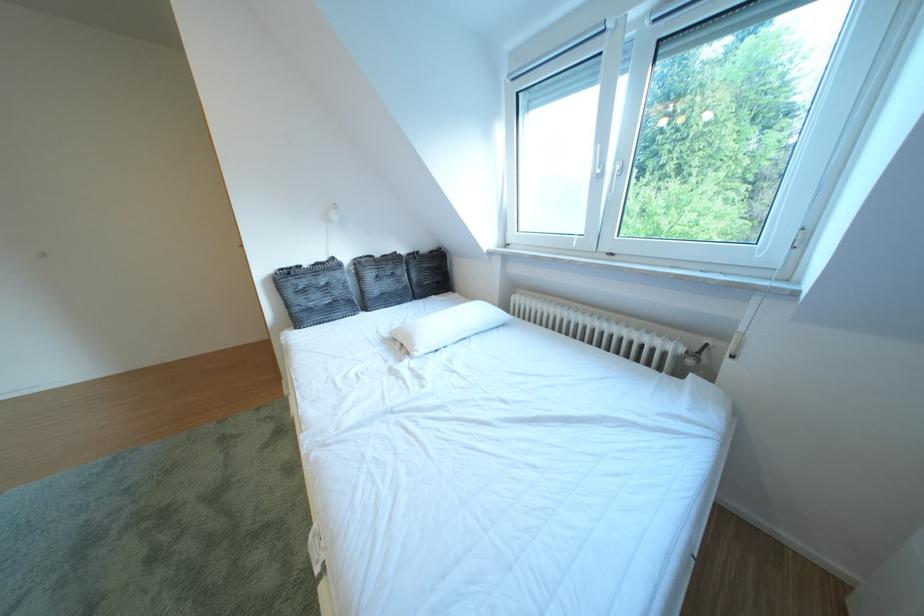
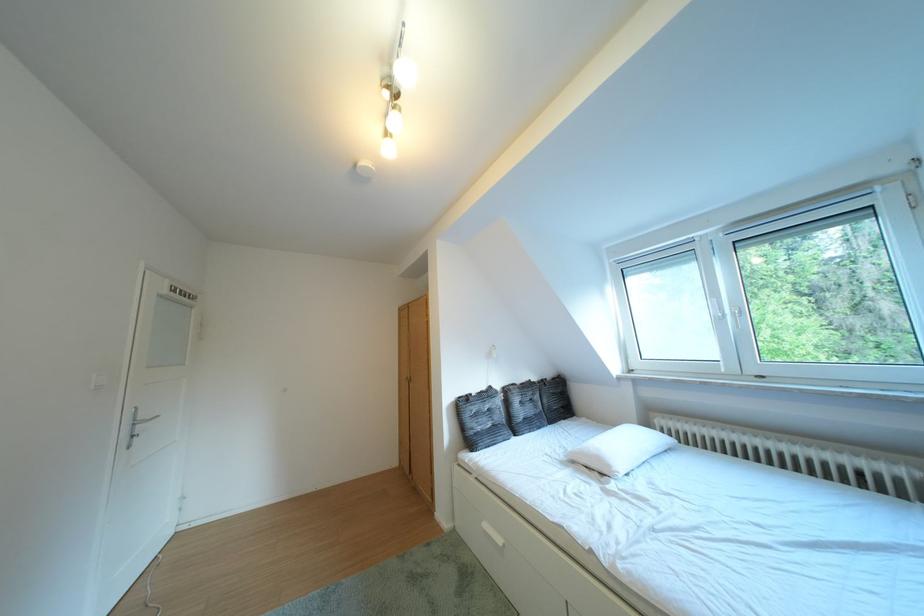
Where in the second image is the point corresponding to point 616,169 from the first image?

(736, 315)